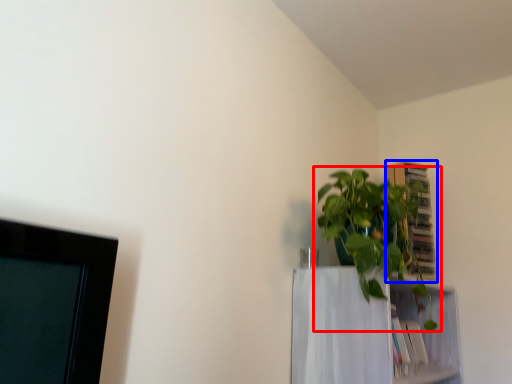
Question: Which of the following is the farthest to the observer, houseplant (highlighted by a red box) or cabinet (highlighted by a blue box)?

Choices:
 (A) houseplant
 (B) cabinet

Answer: (B)